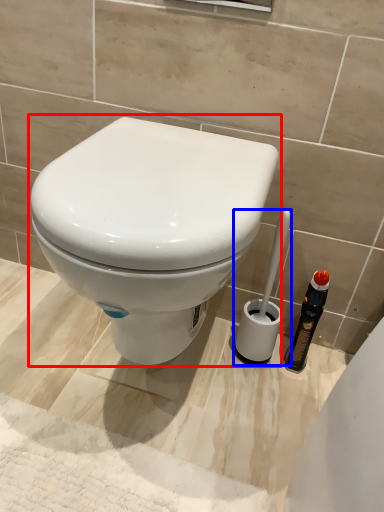
Question: Which of the following is the closest to the observer, toilet (highlighted by a red box) or brush (highlighted by a blue box)?

Choices:
 (A) toilet
 (B) brush

Answer: (A)